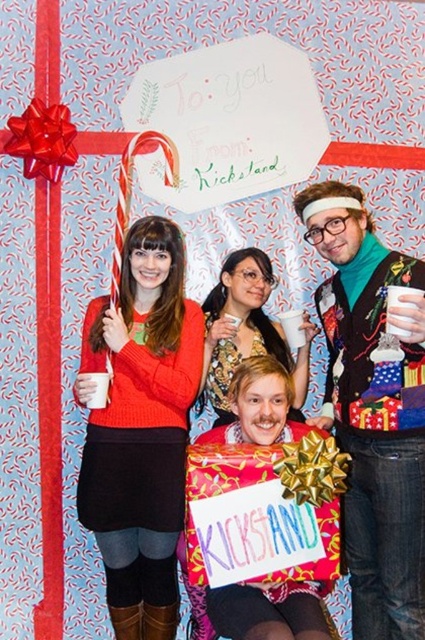
Question: Which point is closer to the camera taking this photo?

Choices:
 (A) (207, 365)
 (B) (393, 611)

Answer: (B)

Question: Which point appears farthest from the camera in this image?

Choices:
 (A) coord(229,358)
 (B) coord(354,428)

Answer: (A)

Question: Is matte orange sweater at center further to camera compared to velvet teal sweater at center?

Choices:
 (A) no
 (B) yes

Answer: (B)

Question: Considering the relative positions of matte orange sweater at center and matte black sweater at center in the image provided, where is matte orange sweater at center located with respect to matte black sweater at center?

Choices:
 (A) above
 (B) below

Answer: (B)

Question: Among these objects, which one is farthest from the camera?

Choices:
 (A) matte black sweater at center
 (B) velvet teal sweater at center

Answer: (A)

Question: Can you confirm if matte orange sweater at center is bigger than matte black sweater at center?

Choices:
 (A) no
 (B) yes

Answer: (B)